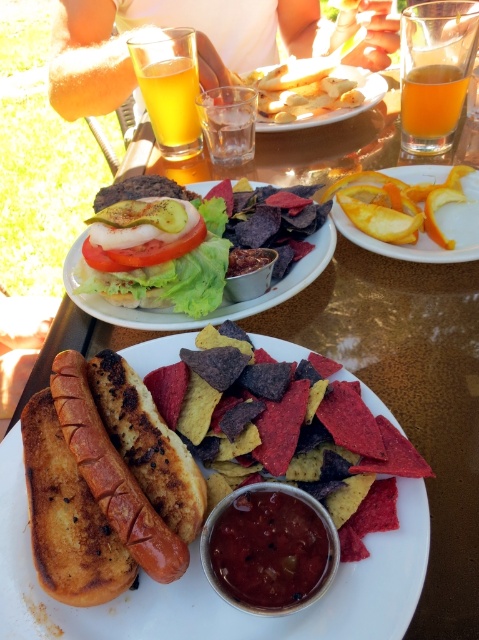
Is grilled bread hot dog at center bigger than smokey red paste at center?

Correct, grilled bread hot dog at center is larger in size than smokey red paste at center.

Is grilled bread hot dog at center smaller than smokey red paste at center?

Incorrect, grilled bread hot dog at center is not smaller in size than smokey red paste at center.

The height and width of the screenshot is (640, 479). Identify the location of grilled bread hot dog at center. (129, 460).

Does point (296, 401) lie in front of point (453, 124)?

Yes.

Who is more distant from viewer, (x=357, y=392) or (x=403, y=83)?

Positioned behind is point (x=403, y=83).

Who is more distant from viewer, [349,406] or [455,115]?

Positioned behind is point [455,115].

This screenshot has height=640, width=479. I want to click on multicolored tortilla chips at center, so click(286, 419).

Is point (363, 522) positioned after point (219, 557)?

Yes, it is behind point (219, 557).

Who is more distant from viewer, (266, 355) or (299, 556)?

The point (266, 355) is more distant.

Is point (357, 388) closer to camera compared to point (299, 536)?

No.

Identify the location of multicolored tortilla chips at center. The image size is (479, 640). (286, 419).